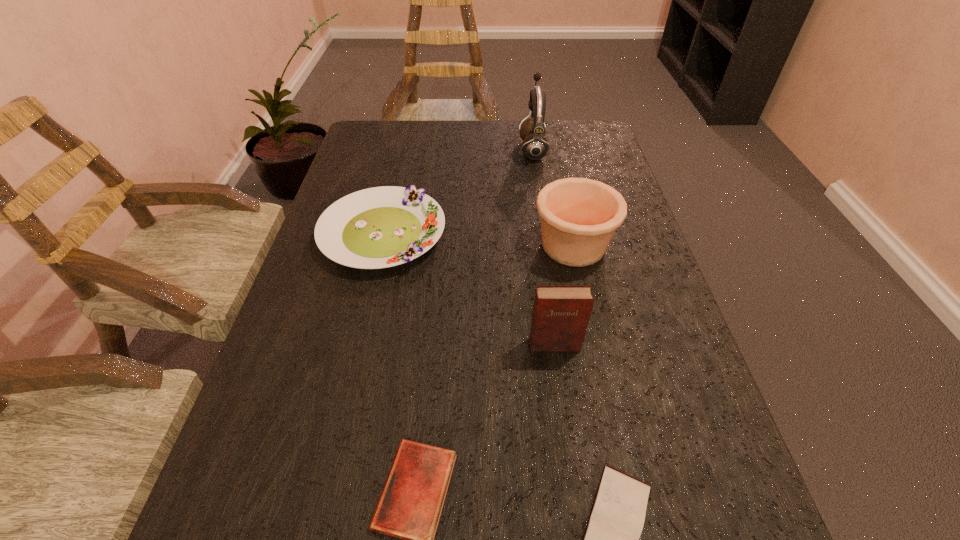
You are a GUI agent. You are given a task and a screenshot of the screen. Output one action in this format:
    pyautogui.click(x=<x>, y=<y>)
    Task: Click on the farthest object
    
    Given the screenshot: What is the action you would take?
    pyautogui.click(x=535, y=145)

This screenshot has width=960, height=540. What are the coordinates of `earphone` in the screenshot? It's located at (535, 145).

Identify the location of the tallest diary. The width and height of the screenshot is (960, 540). (561, 313).

This screenshot has height=540, width=960. In order to click on the fourth farthest object in this screenshot , I will do `click(561, 313)`.

The width and height of the screenshot is (960, 540). I want to click on pottery, so tap(579, 216).

The image size is (960, 540). In order to click on the fourth tallest object in this screenshot , I will do `click(380, 227)`.

Image resolution: width=960 pixels, height=540 pixels. Identify the location of free space located 0.190m on the ear pads of the farthest object. (455, 150).

This screenshot has width=960, height=540. Find the location of `free location located on the ear pads of the farthest object`. free location located on the ear pads of the farthest object is located at coordinates (425, 150).

Image resolution: width=960 pixels, height=540 pixels. I want to click on free space located on the ear pads of the farthest object, so click(459, 150).

The image size is (960, 540). In order to click on free location located on the front cover of the farthest diary in this screenshot , I will do `click(560, 380)`.